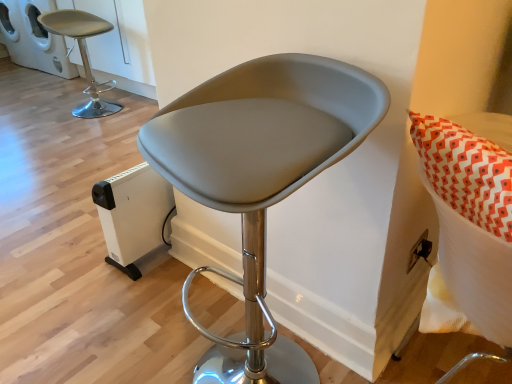
Question: Is white plastic cat house at upper left, the 1th appliance viewed from the left, oriented towards white plastic heater at lower left, marked as the 1th appliance in a right-to-left arrangement?

Choices:
 (A) no
 (B) yes

Answer: (A)

Question: Can you confirm if white plastic cat house at upper left, the second appliance when ordered from front to back, is thinner than white plastic heater at lower left, placed as the second appliance when sorted from top to bottom?

Choices:
 (A) no
 (B) yes

Answer: (A)

Question: Is white plastic cat house at upper left, the 1th appliance viewed from the left, to the left of white plastic heater at lower left, acting as the 1th appliance starting from the bottom, from the viewer's perspective?

Choices:
 (A) no
 (B) yes

Answer: (B)

Question: Is white plastic cat house at upper left, the 1th appliance viewed from the left, taller than white plastic heater at lower left, the first appliance positioned from the front?

Choices:
 (A) no
 (B) yes

Answer: (B)

Question: Is white plastic cat house at upper left, the 1th appliance viewed from the left, positioned before white plastic heater at lower left, the first appliance positioned from the front?

Choices:
 (A) yes
 (B) no

Answer: (B)

Question: Is white plastic cat house at upper left, the second appliance from the right, located outside white plastic heater at lower left, which is the 2th appliance from left to right?

Choices:
 (A) yes
 (B) no

Answer: (A)

Question: Considering the relative sizes of matte gray stool at center, which is the 1th chair in front-to-back order, and white plastic cat house at upper left, which is the first appliance in back-to-front order, in the image provided, is matte gray stool at center, which is the 1th chair in front-to-back order, bigger than white plastic cat house at upper left, which is the first appliance in back-to-front order,?

Choices:
 (A) yes
 (B) no

Answer: (B)

Question: Is matte gray stool at center, the second chair when ordered from top to bottom, looking in the opposite direction of white plastic cat house at upper left, the second appliance from the right?

Choices:
 (A) no
 (B) yes

Answer: (A)

Question: Considering the relative sizes of matte gray stool at center, acting as the 1th chair starting from the bottom, and white plastic cat house at upper left, the 1th appliance viewed from the left, in the image provided, is matte gray stool at center, acting as the 1th chair starting from the bottom, wider than white plastic cat house at upper left, the 1th appliance viewed from the left,?

Choices:
 (A) yes
 (B) no

Answer: (B)

Question: Can you confirm if matte gray stool at center, which is the 1th chair in front-to-back order, is positioned to the left of white plastic cat house at upper left, the second appliance when ordered from front to back?

Choices:
 (A) yes
 (B) no

Answer: (B)

Question: Is the surface of matte gray stool at center, acting as the 1th chair starting from the bottom, in direct contact with white plastic cat house at upper left, the second appliance from the right?

Choices:
 (A) no
 (B) yes

Answer: (A)

Question: From a real-world perspective, is matte gray stool at center, which appears as the 2th chair when viewed from the back, on white plastic cat house at upper left, arranged as the 1th appliance when viewed from the top?

Choices:
 (A) no
 (B) yes

Answer: (B)

Question: Considering the relative positions of white plastic heater at lower left, acting as the 1th appliance starting from the bottom, and white plastic cat house at upper left, which is the 2th appliance in bottom-to-top order, in the image provided, is white plastic heater at lower left, acting as the 1th appliance starting from the bottom, in front of white plastic cat house at upper left, which is the 2th appliance in bottom-to-top order,?

Choices:
 (A) yes
 (B) no

Answer: (A)